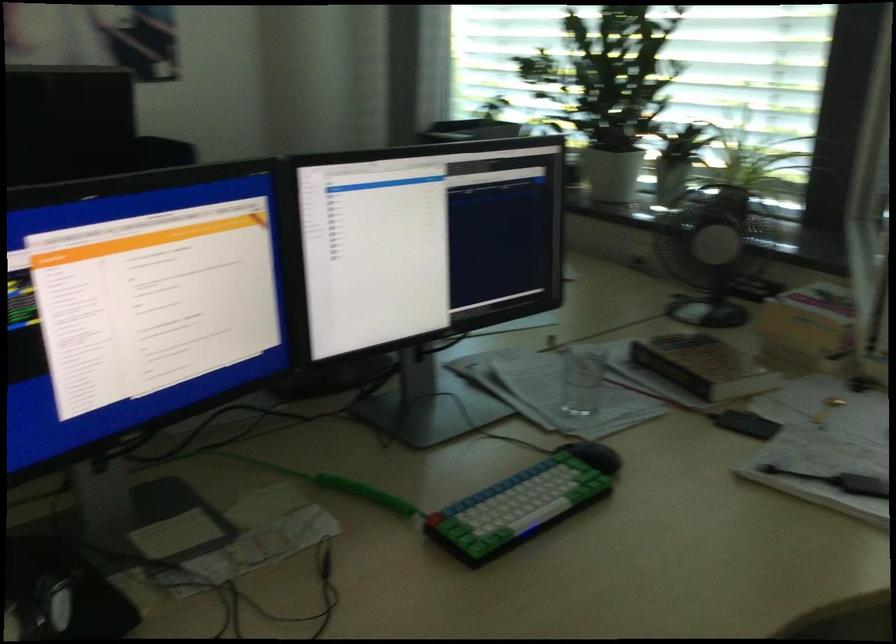
Describe the element at coordinates (612, 174) in the screenshot. I see `a white plant pot` at that location.